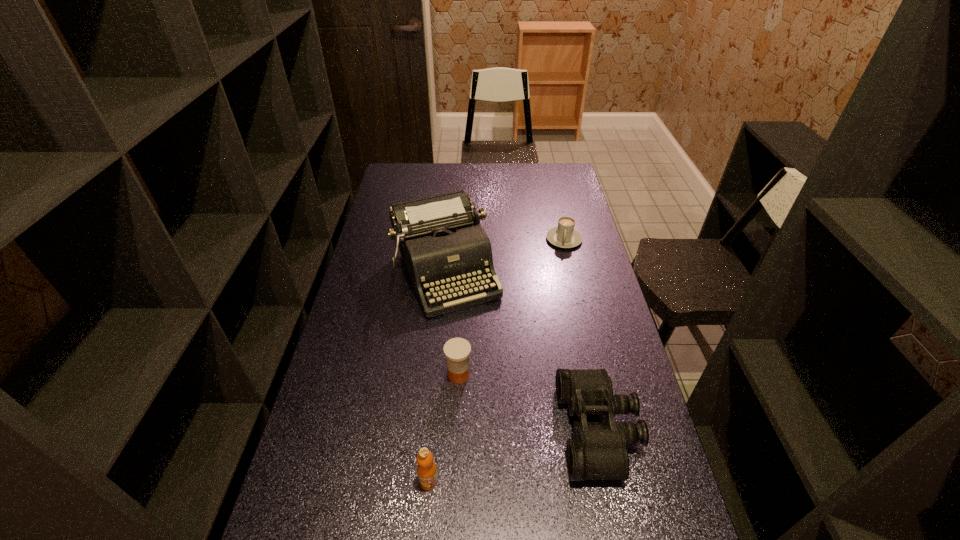
Image resolution: width=960 pixels, height=540 pixels. Identify the location of free space located 0.220m to the right of the cappuccino. (558, 288).

Locate an element on the screen. This screenshot has width=960, height=540. free space located to the right of the cappuccino is located at coordinates (556, 299).

The width and height of the screenshot is (960, 540). I want to click on vacant space located 0.050m on the front-facing side of the tallest object, so click(x=469, y=327).

Identify the location of vacant space located on the front-facing side of the tallest object. This screenshot has height=540, width=960. (511, 413).

Locate an element on the screen. This screenshot has width=960, height=540. vacant space situated 0.380m on the front-facing side of the tallest object is located at coordinates point(511,413).

Where is `free space located on the label of the medicine`? free space located on the label of the medicine is located at coordinates (497, 413).

Where is `free point located 0.170m on the label of the medicine`? The height and width of the screenshot is (540, 960). free point located 0.170m on the label of the medicine is located at coordinates (508, 423).

Find the location of a particular element. free space located 0.080m on the label of the medicine is located at coordinates (485, 401).

Find the location of a particular element. This screenshot has height=540, width=960. object positioned at the left edge is located at coordinates click(444, 247).

At what (x,y) coordinates should I click in order to perform the action: click on binoculars present at the right edge. Please return your answer as a coordinate pair (x, y). Looking at the image, I should click on (598, 451).